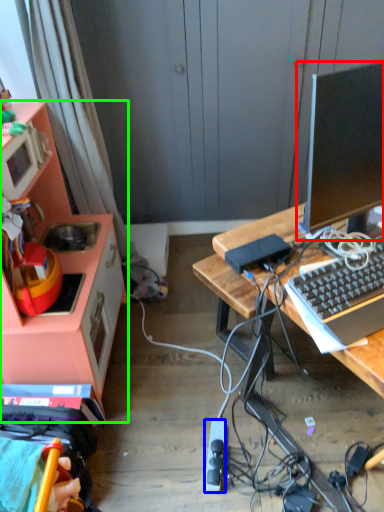
Question: Which is farther away from television (highlighted by a red box)? power outlet (highlighted by a blue box) or cabinetry (highlighted by a green box)?

Choices:
 (A) power outlet
 (B) cabinetry

Answer: (A)